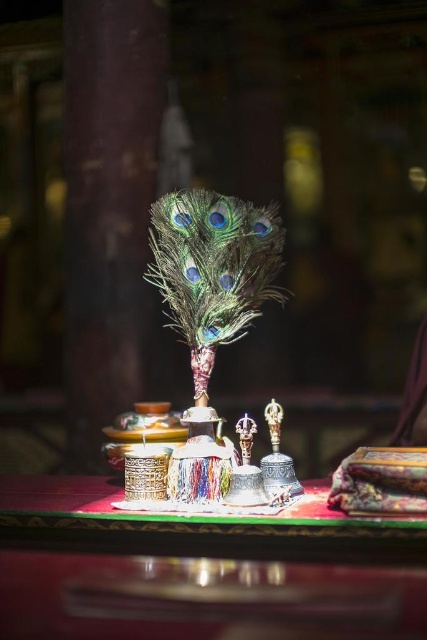
Between shiny dark wood table at center and metallic bell at center, which one appears on the left side from the viewer's perspective?

A: From the viewer's perspective, shiny dark wood table at center appears more on the left side.

Who is more distant from viewer, (66, 500) or (275, 448)?

Positioned behind is point (275, 448).

Who is more forward, [403,616] or [289,483]?

Point [403,616]

The image size is (427, 640). In order to click on shiny dark wood table at center in this screenshot , I will do [199, 570].

Identify the location of metallic gold trophy at center. (245, 472).

From the picture: Who is positioned more to the left, metallic gold trophy at center or metallic bell at center?

metallic gold trophy at center is more to the left.

Between point (240, 445) and point (292, 460), which one is positioned in front?

Point (240, 445) is more forward.

Image resolution: width=427 pixels, height=640 pixels. Find the location of `metallic gold trophy at center`. metallic gold trophy at center is located at coordinates (245, 472).

Which of these two, shiny dark wood table at center or metallic gold trophy at center, stands shorter?

shiny dark wood table at center is shorter.

Which is behind, point (406, 538) or point (249, 435)?

Positioned behind is point (249, 435).

Is point (8, 561) positioned before point (260, 488)?

Yes, point (8, 561) is in front of point (260, 488).

Identify the location of shiny dark wood table at center. (199, 570).